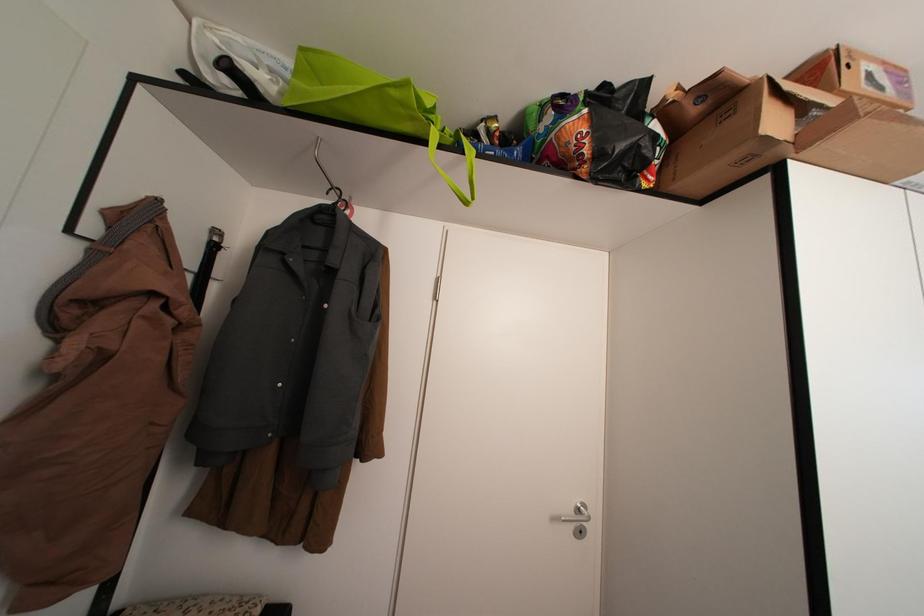
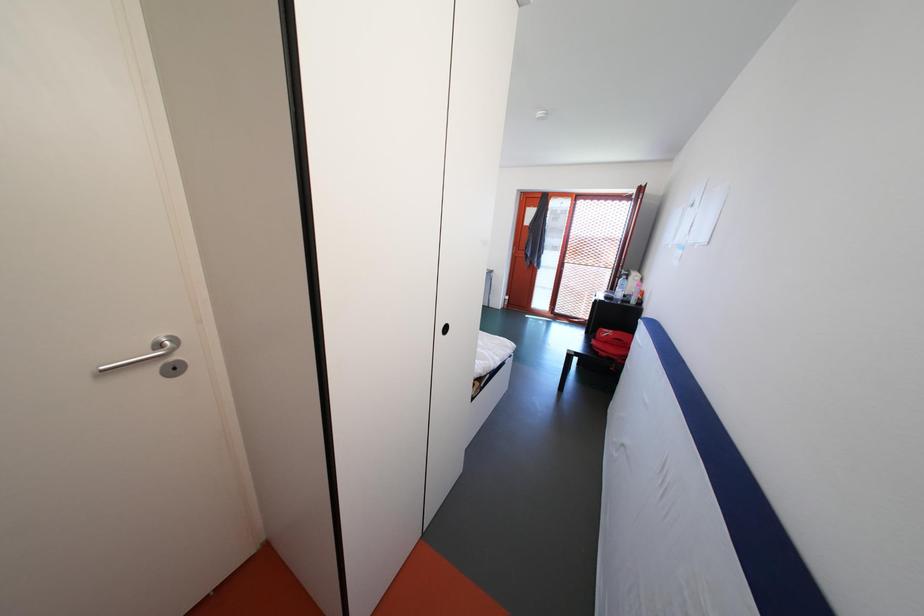
Looking at this image, how did the camera likely rotate?

The rotation direction of the camera is right-down.